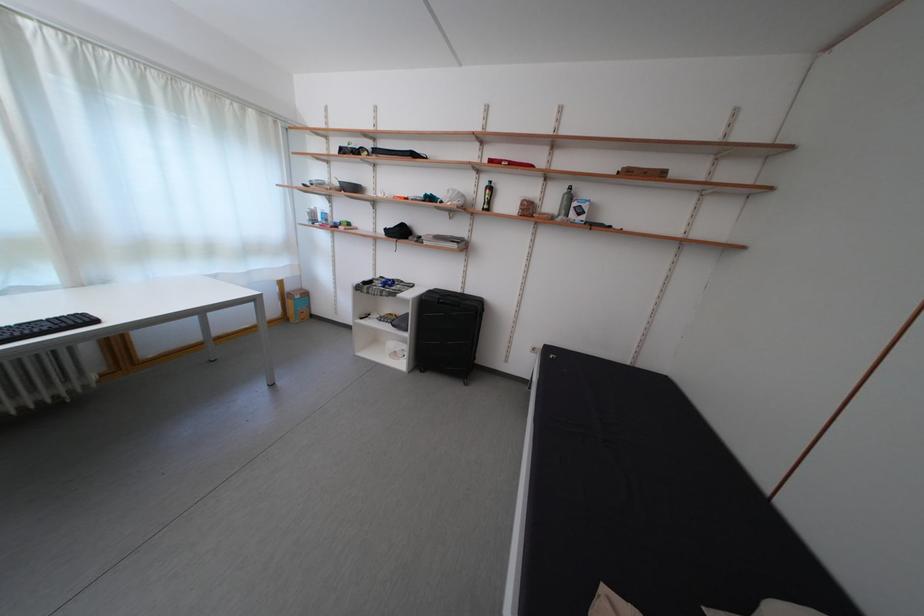
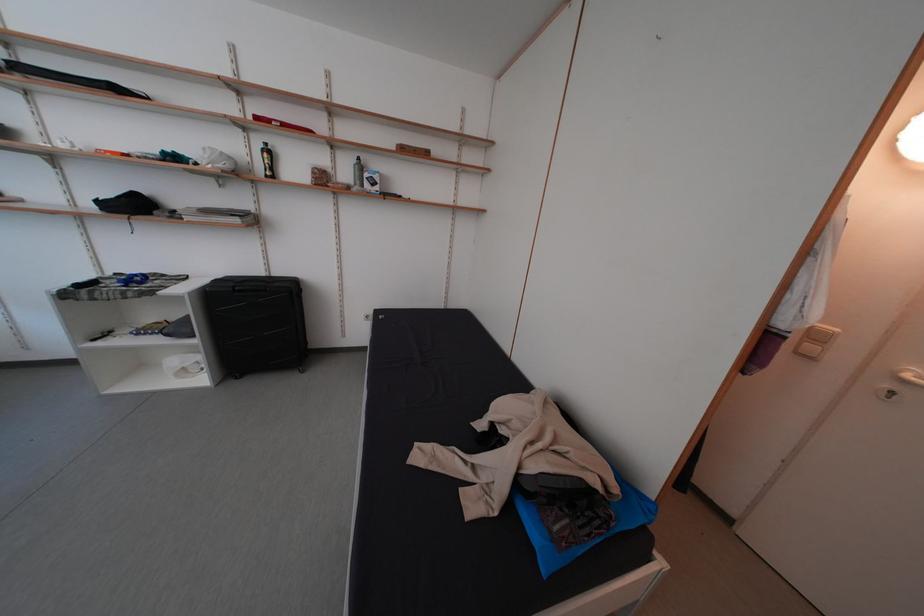
The point at (496, 190) is marked in the first image. Where is the corresponding point in the second image?

(272, 152)